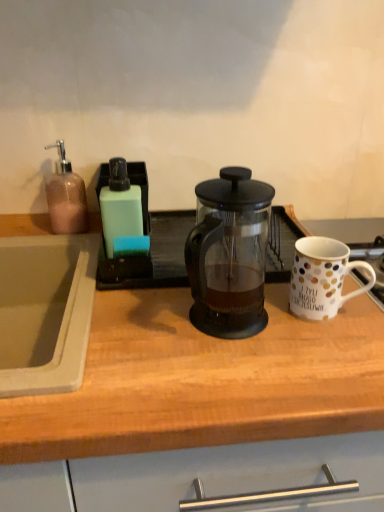
Question: Can you confirm if white polka dot ceramic mug at right is thinner than transparent glass french press at center?

Choices:
 (A) no
 (B) yes

Answer: (B)

Question: Is white polka dot ceramic mug at right to the right of transparent glass french press at center from the viewer's perspective?

Choices:
 (A) yes
 (B) no

Answer: (A)

Question: Is white polka dot ceramic mug at right closer to camera compared to transparent glass french press at center?

Choices:
 (A) no
 (B) yes

Answer: (A)

Question: Is white polka dot ceramic mug at right taller than transparent glass french press at center?

Choices:
 (A) yes
 (B) no

Answer: (B)

Question: Is transparent glass french press at center at the back of white polka dot ceramic mug at right?

Choices:
 (A) yes
 (B) no

Answer: (B)

Question: From the image's perspective, is white polka dot ceramic mug at right on transparent glass french press at center?

Choices:
 (A) no
 (B) yes

Answer: (B)

Question: From the image's perspective, is transparent glass french press at center above transparent glass french press at center?

Choices:
 (A) yes
 (B) no

Answer: (B)

Question: From a real-world perspective, is transparent glass french press at center physically below transparent glass french press at center?

Choices:
 (A) yes
 (B) no

Answer: (A)

Question: Is transparent glass french press at center inside transparent glass french press at center?

Choices:
 (A) yes
 (B) no

Answer: (B)

Question: Considering the relative sizes of transparent glass french press at center and transparent glass french press at center in the image provided, is transparent glass french press at center smaller than transparent glass french press at center?

Choices:
 (A) no
 (B) yes

Answer: (A)

Question: Does transparent glass french press at center have a greater width compared to transparent glass french press at center?

Choices:
 (A) yes
 (B) no

Answer: (A)

Question: Is transparent glass french press at center to the right of transparent glass french press at center from the viewer's perspective?

Choices:
 (A) no
 (B) yes

Answer: (B)

Question: From a real-world perspective, is white polka dot ceramic mug at right located higher than transparent glass french press at center?

Choices:
 (A) no
 (B) yes

Answer: (A)